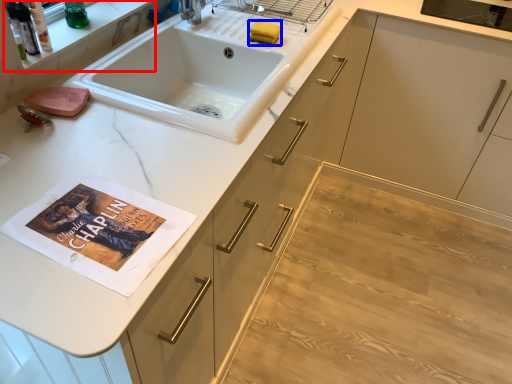
Question: Which object is closer to the camera taking this photo, shelf (highlighted by a red box) or soap (highlighted by a blue box)?

Choices:
 (A) shelf
 (B) soap

Answer: (A)